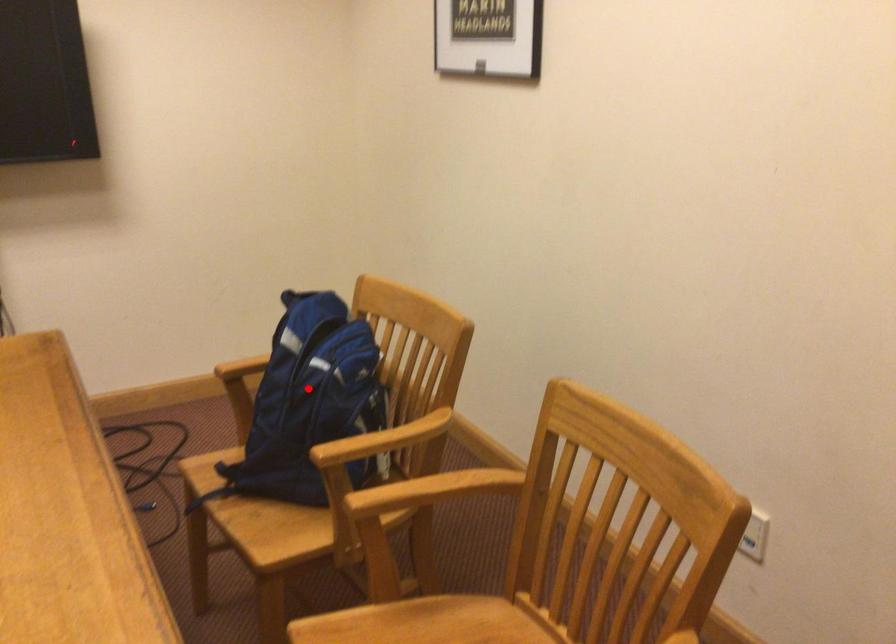
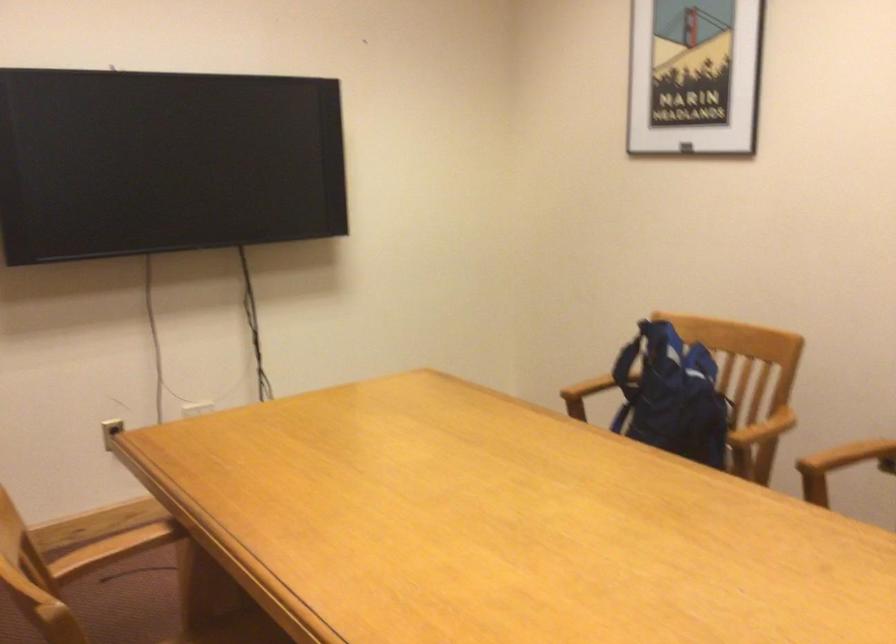
Find the pixel in the second image that matches the highlighted location in the first image.

(672, 395)